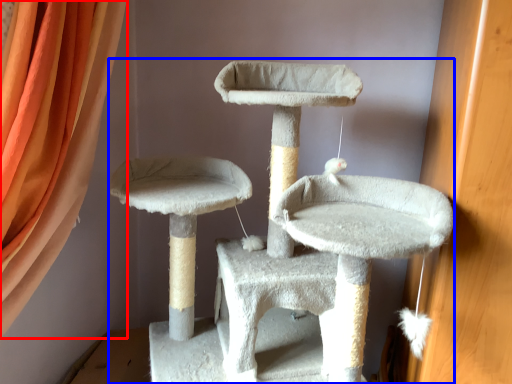
Question: Which object is further to the camera taking this photo, curtain (highlighted by a red box) or cat furniture (highlighted by a blue box)?

Choices:
 (A) curtain
 (B) cat furniture

Answer: (A)